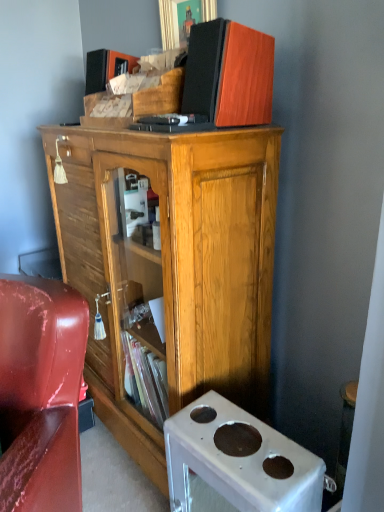
Question: Would you say wooden cabinet at center is inside or outside wooden speaker at upper center?

Choices:
 (A) outside
 (B) inside

Answer: (A)

Question: In the image, is wooden cabinet at center on the left side or the right side of wooden speaker at upper center?

Choices:
 (A) left
 (B) right

Answer: (A)

Question: Which object is the closest to the wooden speaker at upper center?

Choices:
 (A) white plastic desk at lower right
 (B) glossy leather chair at lower left
 (C) wooden cabinet at center

Answer: (C)

Question: Which of these objects is positioned closest to the white plastic desk at lower right?

Choices:
 (A) wooden cabinet at center
 (B) glossy leather chair at lower left
 (C) wooden speaker at upper center

Answer: (B)